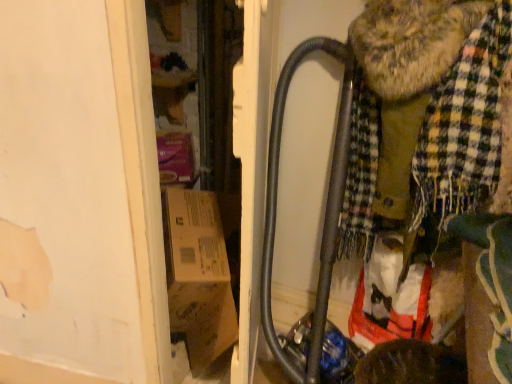
Question: Does metallic gray baby carriage at center-right appear on the right side of plaid fabric scarf at right?

Choices:
 (A) yes
 (B) no

Answer: (A)

Question: From the image's perspective, is metallic gray baby carriage at center-right under plaid fabric scarf at right?

Choices:
 (A) yes
 (B) no

Answer: (B)

Question: Can you confirm if metallic gray baby carriage at center-right is smaller than plaid fabric scarf at right?

Choices:
 (A) no
 (B) yes

Answer: (B)

Question: Considering the relative positions of metallic gray baby carriage at center-right and plaid fabric scarf at right in the image provided, is metallic gray baby carriage at center-right to the left of plaid fabric scarf at right from the viewer's perspective?

Choices:
 (A) no
 (B) yes

Answer: (A)

Question: Considering the relative sizes of metallic gray baby carriage at center-right and plaid fabric scarf at right in the image provided, is metallic gray baby carriage at center-right wider than plaid fabric scarf at right?

Choices:
 (A) no
 (B) yes

Answer: (B)

Question: Is metallic gray baby carriage at center-right closer to the viewer compared to plaid fabric scarf at right?

Choices:
 (A) no
 (B) yes

Answer: (A)

Question: From a real-world perspective, is plaid fabric scarf at right physically below metallic gray baby carriage at center-right?

Choices:
 (A) yes
 (B) no

Answer: (A)

Question: Considering the relative positions of plaid fabric scarf at right and metallic gray baby carriage at center-right in the image provided, is plaid fabric scarf at right in front of metallic gray baby carriage at center-right?

Choices:
 (A) yes
 (B) no

Answer: (A)

Question: Is plaid fabric scarf at right positioned behind metallic gray baby carriage at center-right?

Choices:
 (A) no
 (B) yes

Answer: (A)

Question: From the image's perspective, is plaid fabric scarf at right below metallic gray baby carriage at center-right?

Choices:
 (A) no
 (B) yes

Answer: (B)

Question: Is plaid fabric scarf at right at the left side of metallic gray baby carriage at center-right?

Choices:
 (A) yes
 (B) no

Answer: (A)

Question: Can you confirm if plaid fabric scarf at right is positioned to the right of metallic gray baby carriage at center-right?

Choices:
 (A) yes
 (B) no

Answer: (B)

Question: From a real-world perspective, is plaid fabric scarf at right above or below metallic gray baby carriage at center-right?

Choices:
 (A) below
 (B) above

Answer: (A)